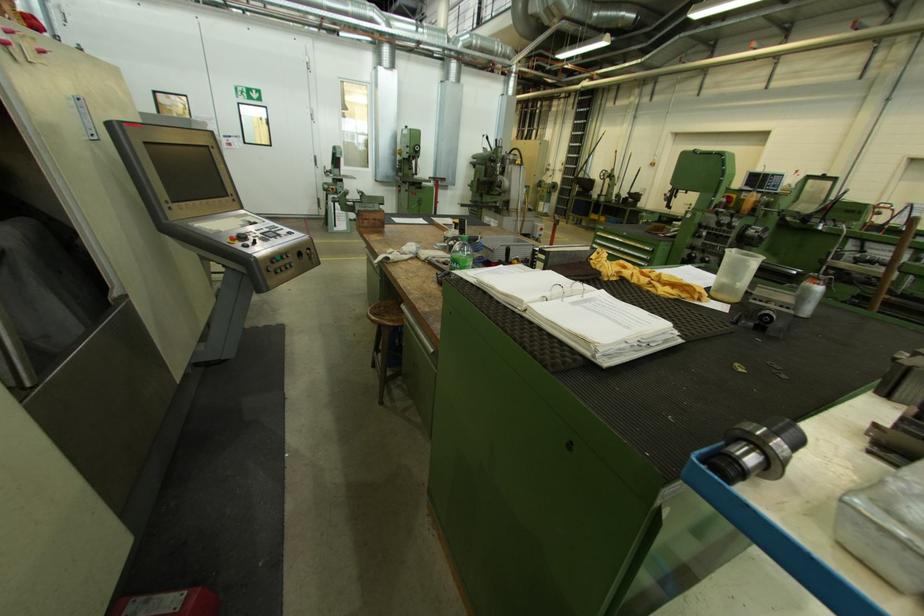
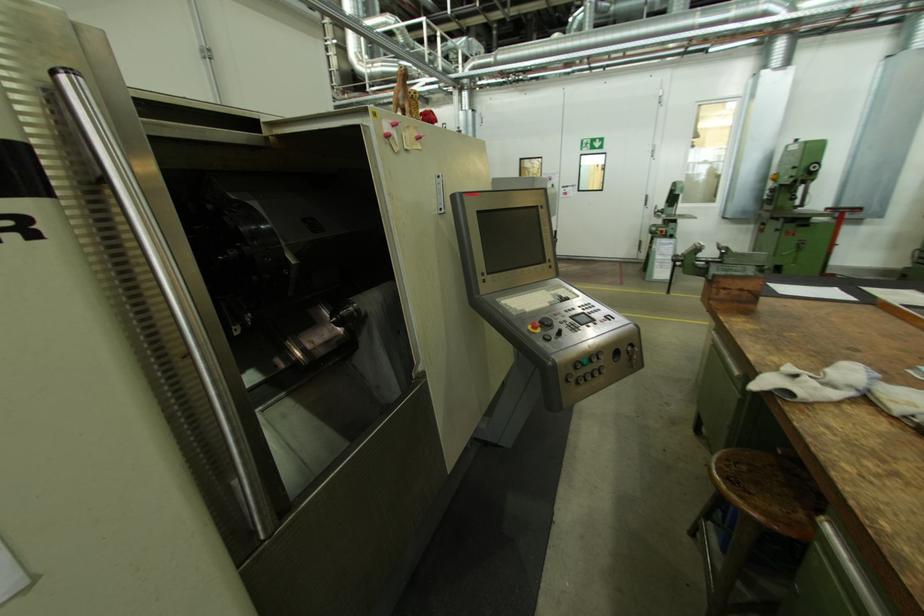
In the second image, find the point that corresponds to the point at 311,257 in the first image.

(629, 357)